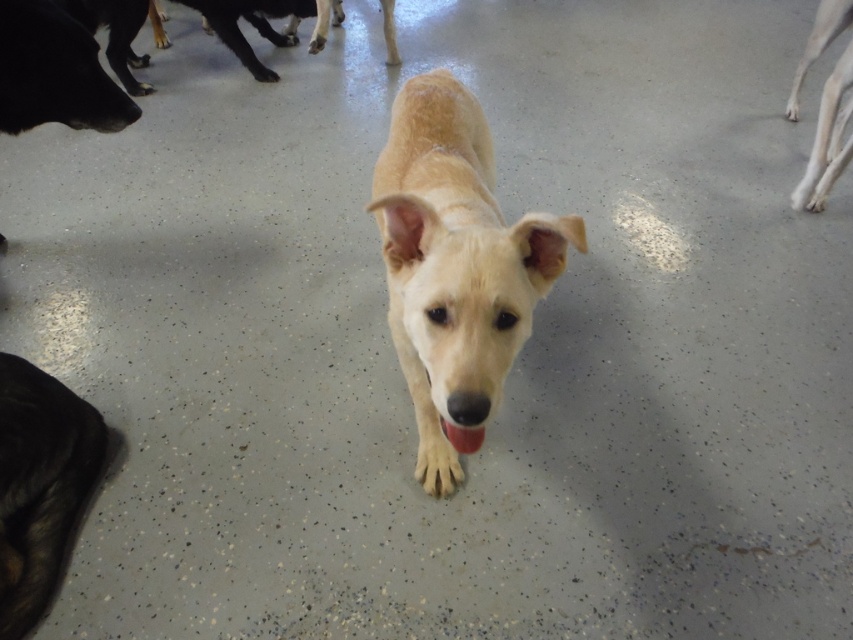
Does light brown fur at center have a smaller size compared to shiny black fur at lower left?

Incorrect, light brown fur at center is not smaller in size than shiny black fur at lower left.

Which is below, light brown fur at center or shiny black fur at lower left?

shiny black fur at lower left is lower down.

Between point (527, 259) and point (21, 381), which one is positioned in front?

Point (527, 259) is in front.

Locate an element on the screen. light brown fur at center is located at coordinates (456, 264).

What do you see at coordinates (54, 72) in the screenshot? This screenshot has width=853, height=640. I see `shiny black dog at left` at bounding box center [54, 72].

Which is more to the left, shiny black dog at left or light brown fur at right?

From the viewer's perspective, shiny black dog at left appears more on the left side.

Measure the distance between point (x=19, y=74) and camera.

The distance of point (x=19, y=74) from camera is 1.95 meters.

Where is `shiny black dog at left`? The width and height of the screenshot is (853, 640). shiny black dog at left is located at coordinates (54, 72).

Which is below, shiny black fur at lower left or pink glossy tongue at center?

Positioned lower is shiny black fur at lower left.

How far apart are shiny black fur at lower left and pink glossy tongue at center?

31.37 inches

Does point (61, 451) come closer to viewer compared to point (469, 433)?

No, (61, 451) is behind (469, 433).

Locate an element on the screen. This screenshot has height=640, width=853. shiny black fur at lower left is located at coordinates (39, 484).